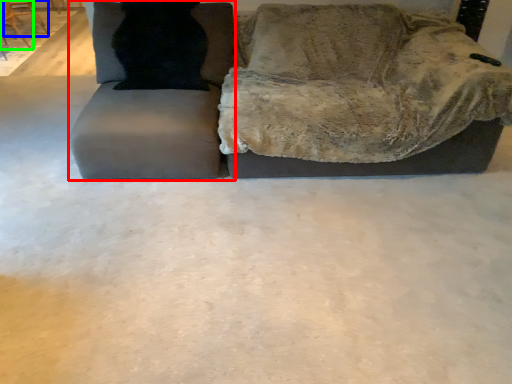
Question: Based on their relative distances, which object is farther from swivel chair (highlighted by a red box)? Choose from chair (highlighted by a blue box) and chair (highlighted by a green box).

Choices:
 (A) chair
 (B) chair

Answer: (A)